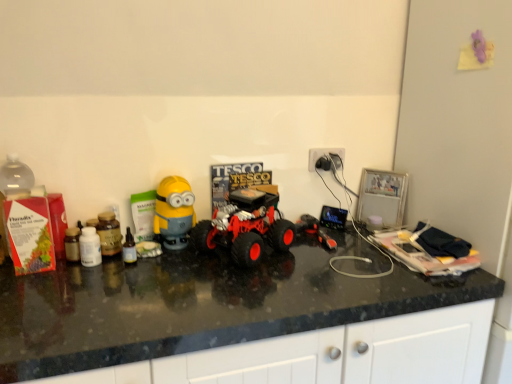
Question: From the image's perspective, is rubberized red monster truck at center, the 2th toy viewed from the right, on black glossy countertop at center?

Choices:
 (A) yes
 (B) no

Answer: (A)

Question: Is rubberized red monster truck at center, which is counted as the second toy, starting from the left, taller than black glossy countertop at center?

Choices:
 (A) no
 (B) yes

Answer: (A)

Question: Is rubberized red monster truck at center, which is counted as the second toy, starting from the left, next to black glossy countertop at center and touching it?

Choices:
 (A) no
 (B) yes

Answer: (A)

Question: Is rubberized red monster truck at center, the 2th toy viewed from the right, far from black glossy countertop at center?

Choices:
 (A) yes
 (B) no

Answer: (B)

Question: Is rubberized red monster truck at center, which is counted as the second toy, starting from the left, not inside black glossy countertop at center?

Choices:
 (A) no
 (B) yes

Answer: (B)

Question: From a real-world perspective, is yellow matte minion toy at center-left, arranged as the third toy when viewed from the right, above or below black glossy countertop at center?

Choices:
 (A) above
 (B) below

Answer: (A)

Question: Is yellow matte minion toy at center-left, arranged as the third toy when viewed from the right, bigger or smaller than black glossy countertop at center?

Choices:
 (A) big
 (B) small

Answer: (B)

Question: Based on their positions, is yellow matte minion toy at center-left, arranged as the third toy when viewed from the right, located to the left or right of black glossy countertop at center?

Choices:
 (A) left
 (B) right

Answer: (A)

Question: Considering the positions of yellow matte minion toy at center-left, which ranks as the 1th toy in left-to-right order, and black glossy countertop at center in the image, is yellow matte minion toy at center-left, which ranks as the 1th toy in left-to-right order, wider or thinner than black glossy countertop at center?

Choices:
 (A) wide
 (B) thin

Answer: (B)

Question: Is black glossy countertop at center inside or outside of rubberized red monster truck at center, which is counted as the second toy, starting from the left?

Choices:
 (A) outside
 (B) inside

Answer: (A)

Question: Considering the positions of point (153, 296) and point (237, 258), is point (153, 296) closer or farther from the camera than point (237, 258)?

Choices:
 (A) farther
 (B) closer

Answer: (B)

Question: Considering their positions, is black glossy countertop at center located in front of or behind rubberized red monster truck at center, the 2th toy viewed from the right?

Choices:
 (A) behind
 (B) front

Answer: (B)

Question: In terms of height, does black glossy countertop at center look taller or shorter compared to rubberized red monster truck at center, the 2th toy viewed from the right?

Choices:
 (A) tall
 (B) short

Answer: (A)

Question: Considering their positions, is rubberized red monster truck at center, the 2th toy viewed from the right, located in front of or behind white plastic plug at upper right?

Choices:
 (A) front
 (B) behind

Answer: (A)

Question: Considering the positions of rubberized red monster truck at center, the 2th toy viewed from the right, and white plastic plug at upper right in the image, is rubberized red monster truck at center, the 2th toy viewed from the right, wider or thinner than white plastic plug at upper right?

Choices:
 (A) wide
 (B) thin

Answer: (A)